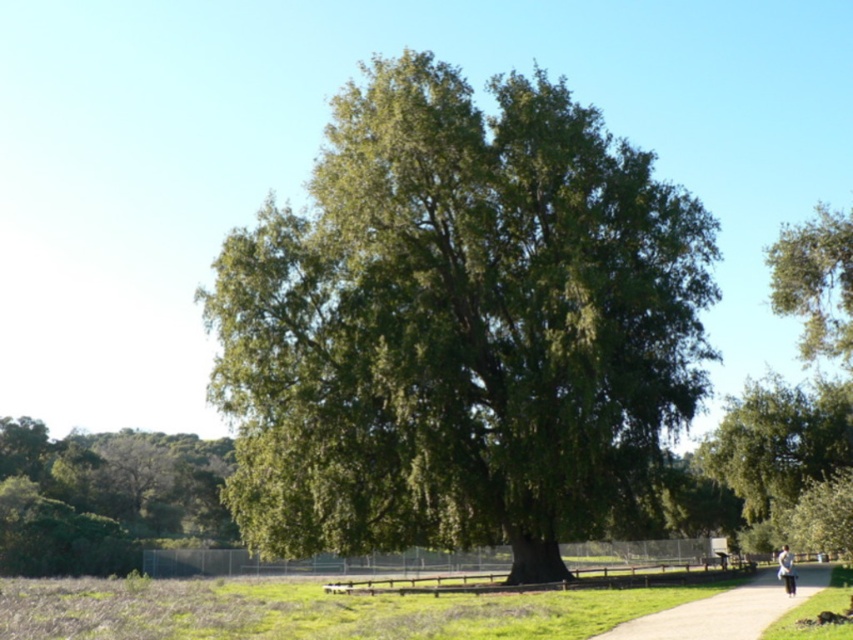
You are standing on the grassy area with patches of dry grass and want to walk to the paved pathway. The green leafy tree at lower left and the light blue jeans at lower right are in your way. Which object is wider so you can decide which side to avoid?

The green leafy tree at lower left is wider than the light blue jeans at lower right, so you should avoid the side of the green leafy tree at lower left to navigate safely.